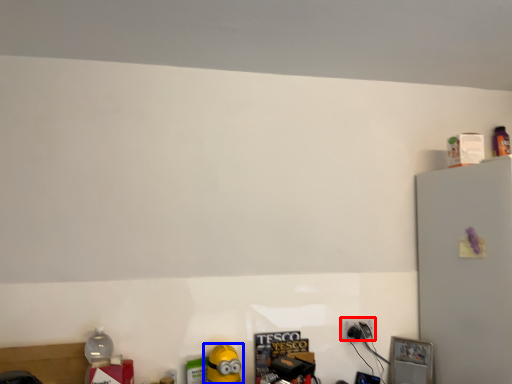
Question: Which object appears farthest to the camera in this image, power plugs and sockets (highlighted by a red box) or toy (highlighted by a blue box)?

Choices:
 (A) power plugs and sockets
 (B) toy

Answer: (A)